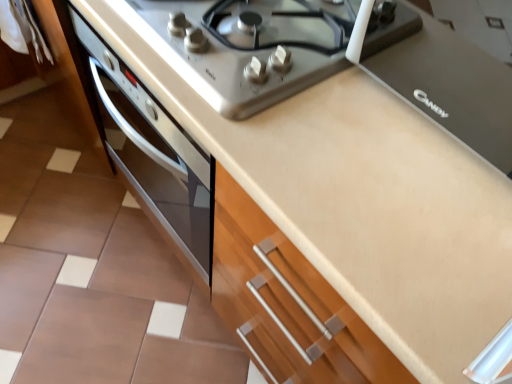
This screenshot has height=384, width=512. Identify the location of satin silver gas stove at upper center. (248, 46).

In order to face satin silver gas stove at upper center, should I rotate leftwards or rightwards?

To align with it, rotate right about 0.425°.

This screenshot has height=384, width=512. Describe the element at coordinates (248, 46) in the screenshot. I see `satin silver gas stove at upper center` at that location.

Measure the distance between black matte stove top at upper center and camera.

black matte stove top at upper center and camera are 26.54 inches apart.

Describe the element at coordinates (452, 87) in the screenshot. I see `black matte stove top at upper center` at that location.

The image size is (512, 384). What are the coordinates of `black matte stove top at upper center` in the screenshot? It's located at (452, 87).

You are a GUI agent. You are given a task and a screenshot of the screen. Output one action in this format:
    pyautogui.click(x=<x>, y=<y>)
    Task: Click on the satin silver gas stove at upper center
    
    Given the screenshot: What is the action you would take?
    [248, 46]

Which is more to the left, black matte stove top at upper center or satin silver gas stove at upper center?

Positioned to the left is satin silver gas stove at upper center.

Is black matte stove top at upper center further to the viewer compared to satin silver gas stove at upper center?

No, the depth of black matte stove top at upper center is less than that of satin silver gas stove at upper center.

Is point (449, 131) closer to viewer compared to point (273, 26)?

Yes, point (449, 131) is closer to viewer.

From the image's perspective, is black matte stove top at upper center over satin silver gas stove at upper center?

No, from the image's perspective, black matte stove top at upper center is not above satin silver gas stove at upper center.

From a real-world perspective, is black matte stove top at upper center positioned above or below satin silver gas stove at upper center?

black matte stove top at upper center is situated higher than satin silver gas stove at upper center in the real world.

Considering the sizes of objects black matte stove top at upper center and satin silver gas stove at upper center in the image provided, who is wider, black matte stove top at upper center or satin silver gas stove at upper center?

With larger width is satin silver gas stove at upper center.

From the picture: Between black matte stove top at upper center and satin silver gas stove at upper center, which one has less height?

Standing shorter between the two is satin silver gas stove at upper center.

Can you confirm if black matte stove top at upper center is smaller than satin silver gas stove at upper center?

Incorrect, black matte stove top at upper center is not smaller in size than satin silver gas stove at upper center.

Consider the image. Is black matte stove top at upper center not within satin silver gas stove at upper center?

black matte stove top at upper center is positioned outside satin silver gas stove at upper center.

Is black matte stove top at upper center next to satin silver gas stove at upper center?

No, black matte stove top at upper center is not making contact with satin silver gas stove at upper center.

Could you tell me if black matte stove top at upper center is facing satin silver gas stove at upper center?

No, black matte stove top at upper center is not turned towards satin silver gas stove at upper center.

Can you tell me how much black matte stove top at upper center and satin silver gas stove at upper center differ in facing direction?

0.395 degrees.

This screenshot has width=512, height=384. I want to click on appliance lying on the right of satin silver gas stove at upper center, so click(452, 87).

Is satin silver gas stove at upper center at the left side of black matte stove top at upper center?

Indeed, satin silver gas stove at upper center is positioned on the left side of black matte stove top at upper center.

Is the position of satin silver gas stove at upper center more distant than that of black matte stove top at upper center?

Yes, satin silver gas stove at upper center is behind black matte stove top at upper center.

Which is nearer, (154, 7) or (443, 57)?

Point (154, 7) is closer to the camera than point (443, 57).

From the image's perspective, which object appears higher, satin silver gas stove at upper center or black matte stove top at upper center?

satin silver gas stove at upper center, from the image's perspective.

Looking at this image, from a real-world perspective, between satin silver gas stove at upper center and black matte stove top at upper center, who is vertically lower?

From a 3D spatial view, satin silver gas stove at upper center is below.

Which object is wider, satin silver gas stove at upper center or black matte stove top at upper center?

satin silver gas stove at upper center.

Who is taller, satin silver gas stove at upper center or black matte stove top at upper center?

With more height is black matte stove top at upper center.

Considering the relative sizes of satin silver gas stove at upper center and black matte stove top at upper center in the image provided, is satin silver gas stove at upper center smaller than black matte stove top at upper center?

Correct, satin silver gas stove at upper center occupies less space than black matte stove top at upper center.

Consider the image. Would you say satin silver gas stove at upper center is outside black matte stove top at upper center?

Absolutely, satin silver gas stove at upper center is external to black matte stove top at upper center.

Is satin silver gas stove at upper center far from black matte stove top at upper center?

No, there isn't a large distance between satin silver gas stove at upper center and black matte stove top at upper center.

Is satin silver gas stove at upper center aimed at black matte stove top at upper center?

No, satin silver gas stove at upper center is not turned towards black matte stove top at upper center.

This screenshot has height=384, width=512. Find the location of `gas stove behind the black matte stove top at upper center`. gas stove behind the black matte stove top at upper center is located at coordinates (248, 46).

Where is `gas stove above the black matte stove top at upper center (from the image's perspective)`? This screenshot has height=384, width=512. gas stove above the black matte stove top at upper center (from the image's perspective) is located at coordinates (248, 46).

The width and height of the screenshot is (512, 384). What are the coordinates of `appliance in front of the satin silver gas stove at upper center` in the screenshot? It's located at (452, 87).